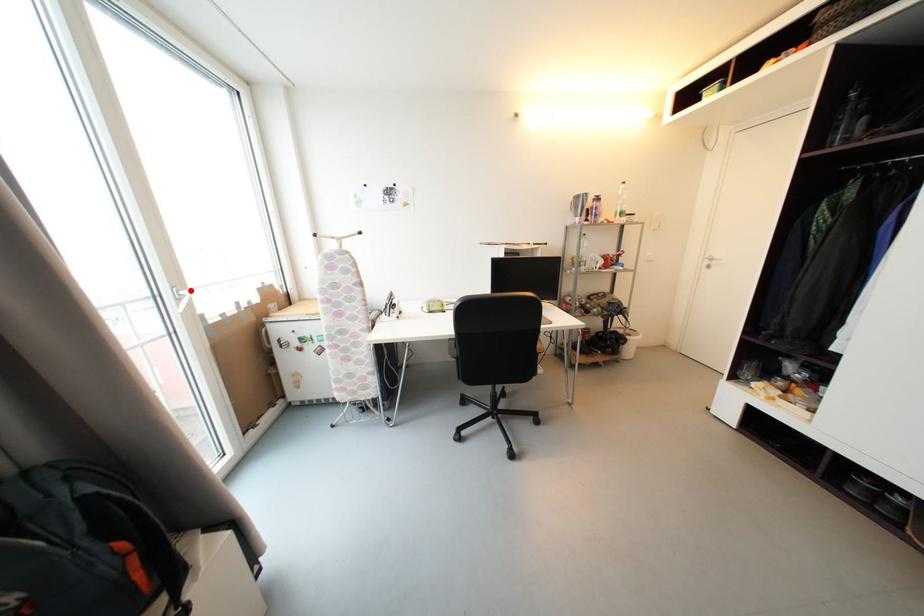
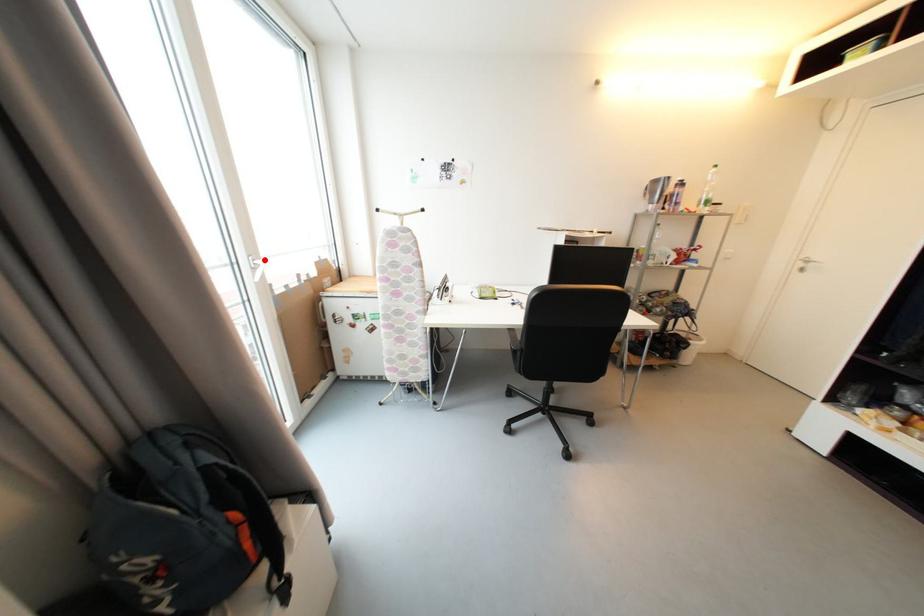
I am providing you with two images of the same scene from different viewpoints. A red point is marked on the first image and another point is marked on the second image. Are the points marked in image1 and image2 representing the same 3D position?

Yes